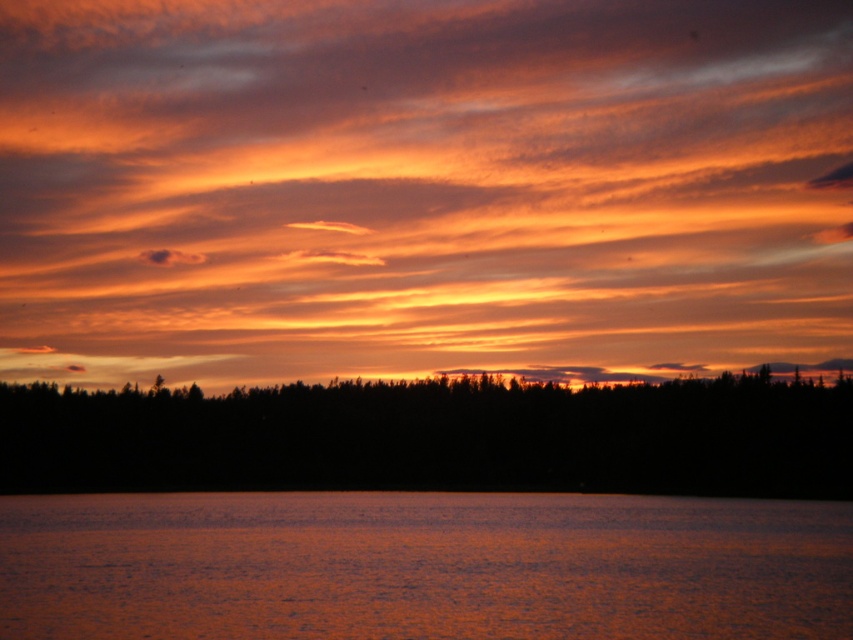
Question: Does orange matte cloud at upper center appear over black silhouette trees at bottom?

Choices:
 (A) no
 (B) yes

Answer: (B)

Question: Which point appears farthest from the camera in this image?

Choices:
 (A) (695, 177)
 (B) (310, 404)

Answer: (A)

Question: Which object appears farthest from the camera in this image?

Choices:
 (A) orange reflective water at bottom
 (B) orange matte cloud at upper center
 (C) black silhouette trees at bottom

Answer: (B)

Question: Is orange reflective water at bottom to the right of black silhouette trees at bottom from the viewer's perspective?

Choices:
 (A) yes
 (B) no

Answer: (A)

Question: Can you confirm if orange reflective water at bottom is positioned above black silhouette trees at bottom?

Choices:
 (A) yes
 (B) no

Answer: (B)

Question: Which point is closer to the camera?

Choices:
 (A) orange matte cloud at upper center
 (B) black silhouette trees at bottom
 (C) orange reflective water at bottom

Answer: (C)